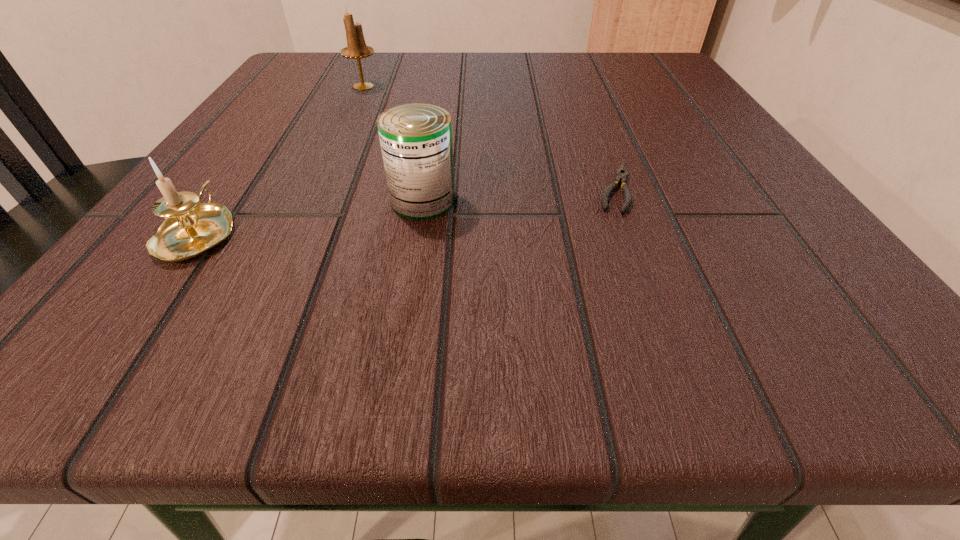
Locate an element on the screen. This screenshot has height=540, width=960. vacant position located on the handle side of the shorter candle holder is located at coordinates (309, 77).

Identify the location of free space located 0.400m on the handle side of the shorter candle holder. (309, 77).

This screenshot has width=960, height=540. Identify the location of vacant area situated 0.170m on the front of the shortest object. (669, 329).

This screenshot has height=540, width=960. In order to click on object situated at the far edge in this screenshot , I will do `click(356, 48)`.

Locate an element on the screen. The image size is (960, 540). object that is positioned at the far left corner is located at coordinates (356, 48).

The image size is (960, 540). In the image, there is a desktop. In order to click on vacant region at the far edge in this screenshot , I will do `click(574, 89)`.

The image size is (960, 540). In the image, there is a desktop. Find the location of `free space at the near edge`. free space at the near edge is located at coordinates (690, 338).

Image resolution: width=960 pixels, height=540 pixels. In the image, there is a desktop. In order to click on vacant space at the left edge in this screenshot , I will do `click(294, 143)`.

I want to click on blank area at the right edge, so click(671, 171).

The image size is (960, 540). Identify the location of free space at the far left corner of the desktop. (350, 76).